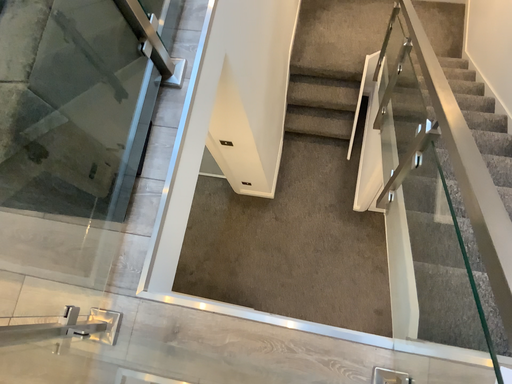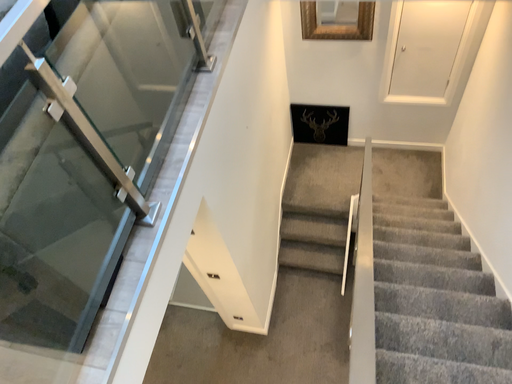
Question: How did the camera likely rotate when shooting the video?

Choices:
 (A) rotated downward
 (B) rotated upward

Answer: (B)